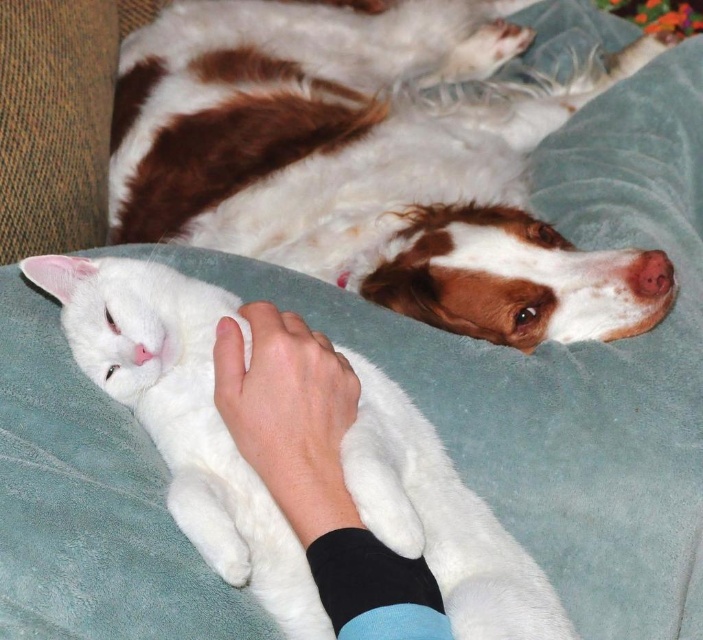
Does white fluffy cat at center have a greater height compared to white fur at center?

Correct, white fluffy cat at center is much taller as white fur at center.

Who is taller, white fluffy cat at center or white fur at center?

white fluffy cat at center

The width and height of the screenshot is (703, 640). Find the location of `white fluffy cat at center`. white fluffy cat at center is located at coordinates (183, 417).

This screenshot has height=640, width=703. Identify the location of black fleece sleeve at lower center. (316, 472).

Can you confirm if black fleece sleeve at lower center is bigger than white fur at center?

Correct, black fleece sleeve at lower center is larger in size than white fur at center.

Identify the location of black fleece sleeve at lower center. (316, 472).

I want to click on black fleece sleeve at lower center, so click(x=316, y=472).

Based on the photo, is brown and white fur at upper center above white fur at center?

Indeed, brown and white fur at upper center is positioned over white fur at center.

Between brown and white fur at upper center and white fur at center, which one appears on the right side from the viewer's perspective?

brown and white fur at upper center is more to the right.

Find the location of a particular element. The image size is (703, 640). brown and white fur at upper center is located at coordinates (368, 163).

This screenshot has width=703, height=640. Find the location of `brown and white fur at upper center`. brown and white fur at upper center is located at coordinates (368, 163).